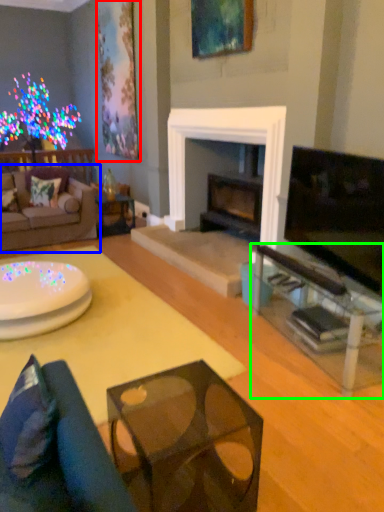
Question: Estimate the real-world distances between objects in this image. Which object is closer to picture frame (highlighted by a red box), studio couch (highlighted by a blue box) or table (highlighted by a green box)?

Choices:
 (A) studio couch
 (B) table

Answer: (A)